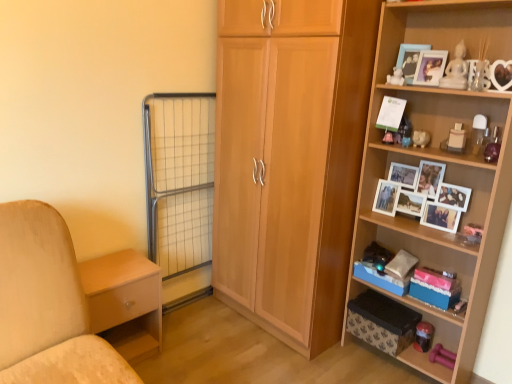
This screenshot has height=384, width=512. What are the coordinates of `empty space that is ontop of light wood/finely finished nightstand at lower left` in the screenshot? It's located at (110, 272).